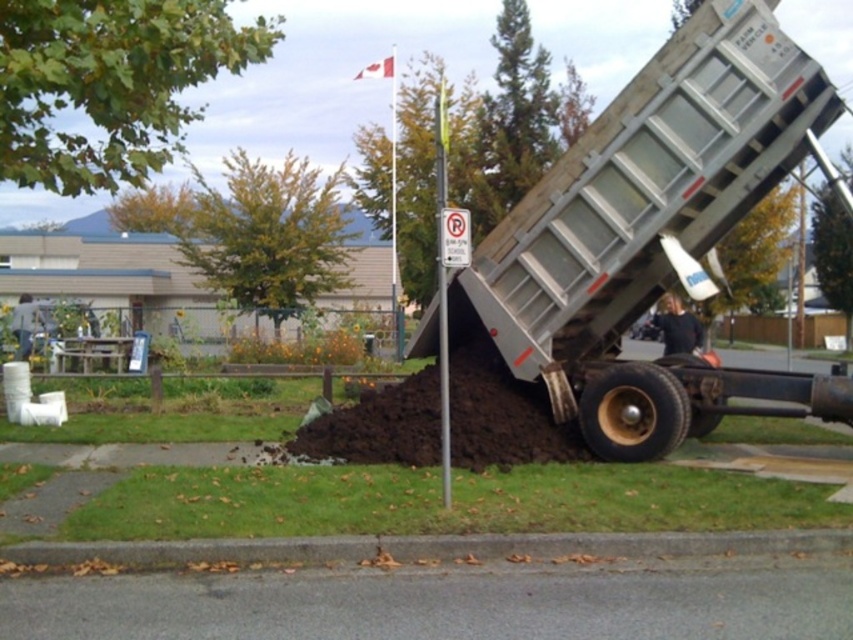
Question: Based on their relative distances, which object is farther from the green leafy tree at upper right?

Choices:
 (A) light blue shirt at left
 (B) metallic silver dump truck at center
 (C) dark brown soil at center

Answer: (A)

Question: Which object is the farthest from the gray concrete curb at lower center?

Choices:
 (A) metallic silver dump truck at center
 (B) yellow-green leaves at upper center

Answer: (B)

Question: Is dark blue shirt at center in front of light blue shirt at left?

Choices:
 (A) no
 (B) yes

Answer: (B)

Question: Where is metallic silver dump truck at center located in relation to dark brown soil at center in the image?

Choices:
 (A) below
 (B) above

Answer: (B)

Question: In this image, where is green leafy tree at upper right located relative to light blue shirt at left?

Choices:
 (A) right
 (B) left

Answer: (A)

Question: Which point is closer to the camera?

Choices:
 (A) (811, 205)
 (B) (119, 209)

Answer: (A)